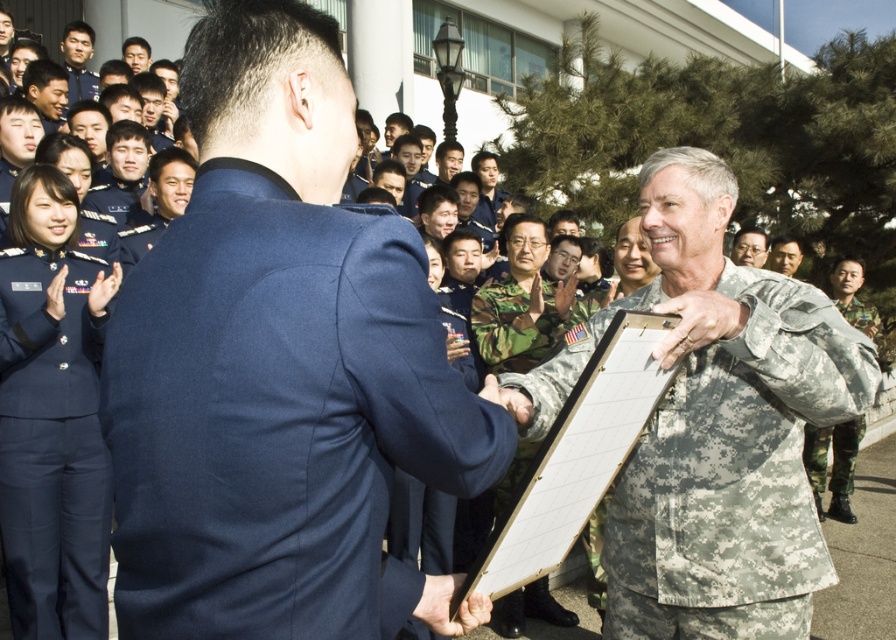
Can you confirm if camouflage fabric uniform at center is positioned above matte gray uniform at center?

Actually, camouflage fabric uniform at center is below matte gray uniform at center.

Based on the photo, which is below, camouflage fabric uniform at center or matte gray uniform at center?

camouflage fabric uniform at center is lower down.

Which is in front, point (860, 433) or point (742, 248)?

Point (742, 248) is more forward.

Identify the location of camouflage fabric uniform at center. This screenshot has height=640, width=896. (833, 456).

Does camouflage fabric clipboard at center appear on the left side of matte gray uniform at center?

Indeed, camouflage fabric clipboard at center is positioned on the left side of matte gray uniform at center.

Is camouflage fabric clipboard at center taller than matte gray uniform at center?

Yes, camouflage fabric clipboard at center is taller than matte gray uniform at center.

Which is behind, point (728, 627) or point (742, 236)?

The point (742, 236) is behind.

Where is `camouflage fabric clipboard at center`? camouflage fabric clipboard at center is located at coordinates click(737, 458).

Is camouflage fabric clipboard at center shorter than camouflage fabric uniform at center?

No.

Does camouflage fabric clipboard at center have a greater width compared to camouflage fabric uniform at center?

In fact, camouflage fabric clipboard at center might be narrower than camouflage fabric uniform at center.

Does point (729, 284) come closer to viewer compared to point (860, 321)?

Yes, it is.

You are a GUI agent. You are given a task and a screenshot of the screen. Output one action in this format:
    pyautogui.click(x=<x>, y=<y>)
    Task: Click on the camouflage fabric clipboard at center
    The image size is (896, 640).
    Given the screenshot: What is the action you would take?
    pyautogui.click(x=737, y=458)